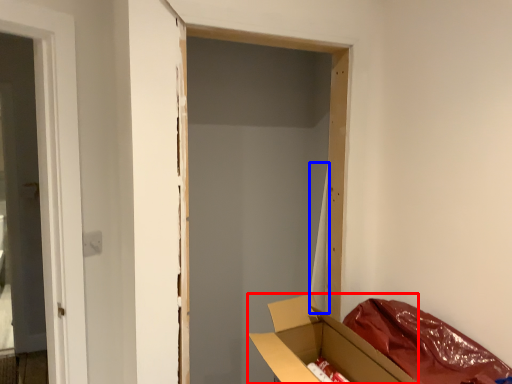
Question: Among these objects, which one is nearest to the camera, box (highlighted by a red box) or curtain (highlighted by a blue box)?

Choices:
 (A) box
 (B) curtain

Answer: (A)